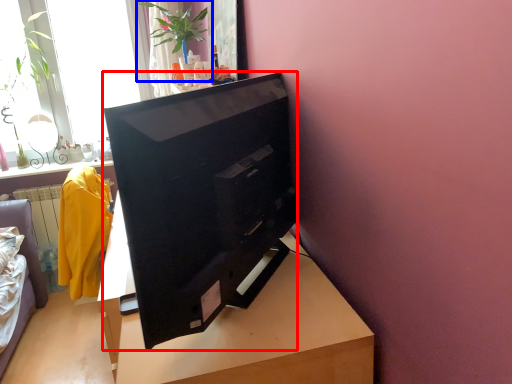
Question: Which object is further to the camera taking this photo, television (highlighted by a red box) or houseplant (highlighted by a blue box)?

Choices:
 (A) television
 (B) houseplant

Answer: (B)